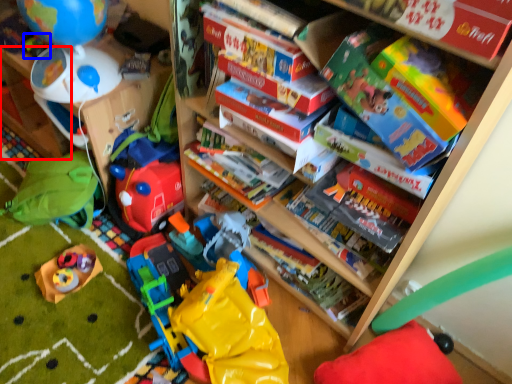
Question: Which object is further to the camera taking this photo, shelf (highlighted by a red box) or toy (highlighted by a blue box)?

Choices:
 (A) shelf
 (B) toy

Answer: (A)